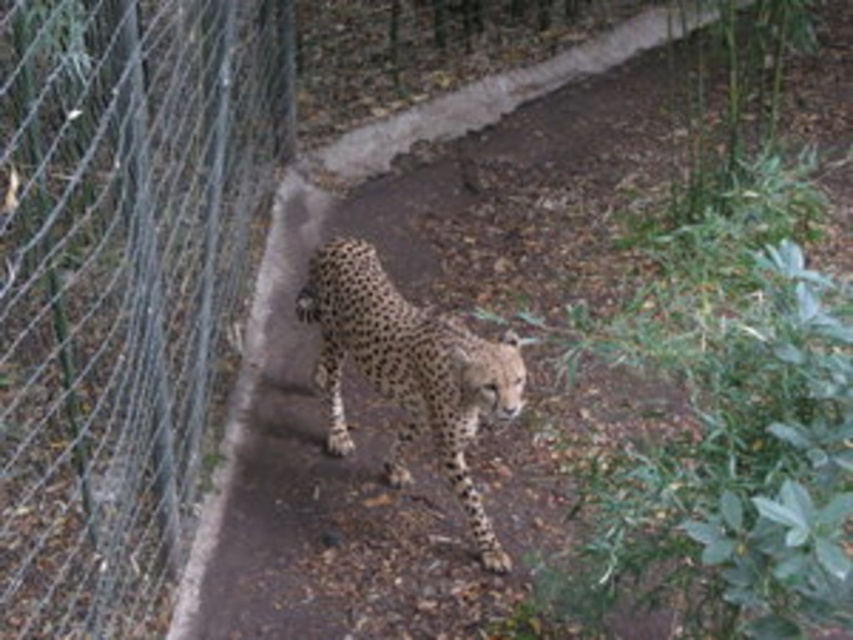
You are a zookeeper observing the cheetah in its enclosure. You notice a specific point marked at coordinates (408, 369). Based on the image, where is this point located?

The point at (408, 369) is located on the spotted fur of the cheetah at center.

A zookeeper needs to place two feeding stations exactly at the two points marked as point (20, 173). The minimum distance required between feeding stations is 10 feet for safety. Can the zookeeper safely place both stations at those points?

The two points marked as point (20, 173) are 13.73 feet apart, which exceeds the minimum required distance of 10 feet. Therefore, the zookeeper can safely place both feeding stations at those points.

You are a zookeeper observing the spotted fur cheetah at center and the brown dirt path at center. Which object is positioned lower in the image?

The spotted fur cheetah at center is positioned lower than the brown dirt path at center.